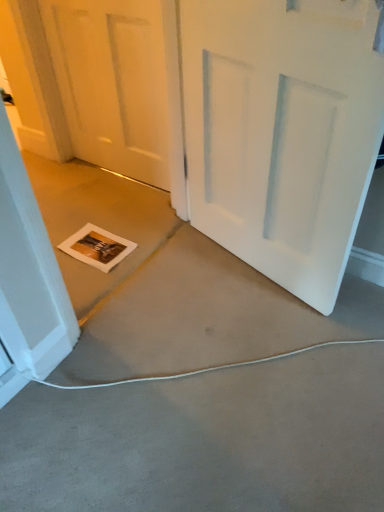
Question: Is white matte door at center, which ranks as the 1th door in right-to-left order, thinner than white matte door at center, acting as the 2th door starting from the right?

Choices:
 (A) yes
 (B) no

Answer: (B)

Question: Is the position of white matte door at center, the second door positioned from the left, less distant than that of white matte door at center, which is the 1th door in left-to-right order?

Choices:
 (A) no
 (B) yes

Answer: (B)

Question: Could you tell me if white matte door at center, the second door positioned from the left, is turned towards white matte door at center, which is the 1th door in left-to-right order?

Choices:
 (A) yes
 (B) no

Answer: (B)

Question: Is white matte door at center, the second door positioned from the left, wider than white matte door at center, acting as the 2th door starting from the right?

Choices:
 (A) yes
 (B) no

Answer: (A)

Question: From a real-world perspective, is white matte door at center, the second door positioned from the left, positioned over white matte door at center, acting as the 2th door starting from the right, based on gravity?

Choices:
 (A) no
 (B) yes

Answer: (B)

Question: From the image's perspective, relative to white matte door at center, the second door positioned from the left, is white matte door at center, acting as the 2th door starting from the right, above or below?

Choices:
 (A) below
 (B) above

Answer: (B)

Question: Based on their sizes in the image, would you say white matte door at center, which is the 1th door in left-to-right order, is bigger or smaller than white matte door at center, which ranks as the 1th door in right-to-left order?

Choices:
 (A) small
 (B) big

Answer: (A)

Question: Do you think white matte door at center, which is the 1th door in left-to-right order, is within white matte door at center, the second door positioned from the left, or outside of it?

Choices:
 (A) inside
 (B) outside

Answer: (B)

Question: Considering the relative positions of white matte door at center, acting as the 2th door starting from the right, and white matte door at center, the second door positioned from the left, in the image provided, is white matte door at center, acting as the 2th door starting from the right, to the left or to the right of white matte door at center, the second door positioned from the left,?

Choices:
 (A) left
 (B) right

Answer: (A)

Question: Is white matte door at center, the second door positioned from the left, taller or shorter than gray carpet at lower center?

Choices:
 (A) tall
 (B) short

Answer: (A)

Question: Based on their sizes in the image, would you say white matte door at center, which ranks as the 1th door in right-to-left order, is bigger or smaller than gray carpet at lower center?

Choices:
 (A) small
 (B) big

Answer: (A)

Question: Relative to gray carpet at lower center, is white matte door at center, which ranks as the 1th door in right-to-left order, in front or behind?

Choices:
 (A) front
 (B) behind

Answer: (B)

Question: Looking at their shapes, would you say white matte door at center, which ranks as the 1th door in right-to-left order, is wider or thinner than gray carpet at lower center?

Choices:
 (A) thin
 (B) wide

Answer: (A)

Question: From a real-world perspective, is white matte door at center, which ranks as the 1th door in right-to-left order, positioned above or below white matte door at center, acting as the 2th door starting from the right?

Choices:
 (A) above
 (B) below

Answer: (A)

Question: Is white matte door at center, which ranks as the 1th door in right-to-left order, spatially inside white matte door at center, acting as the 2th door starting from the right, or outside of it?

Choices:
 (A) inside
 (B) outside

Answer: (B)